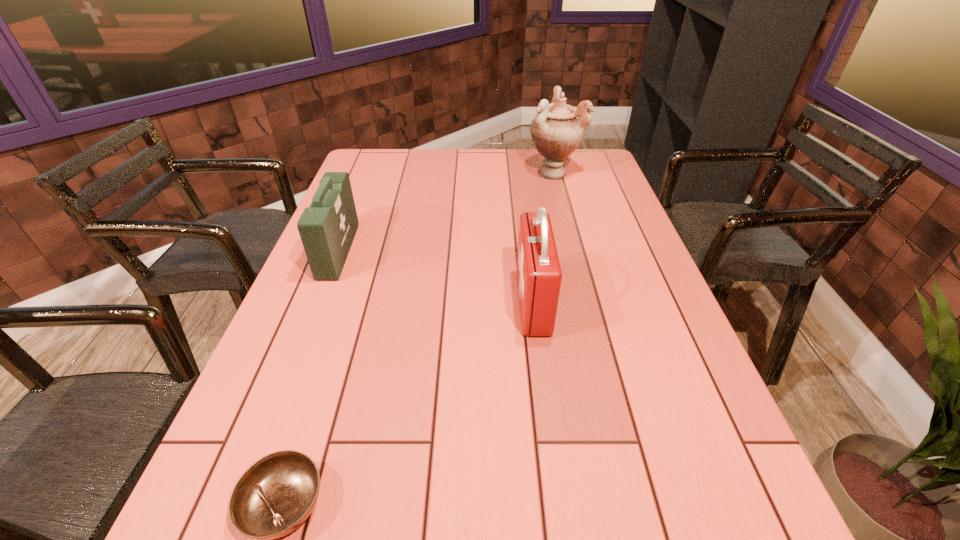
Find the location of a particular element. This screenshot has height=540, width=960. free space that satisfies the following two spatial constraints: 1. on the front side of the rightmost object; 2. on the front face of the right first-aid kit is located at coordinates (588, 302).